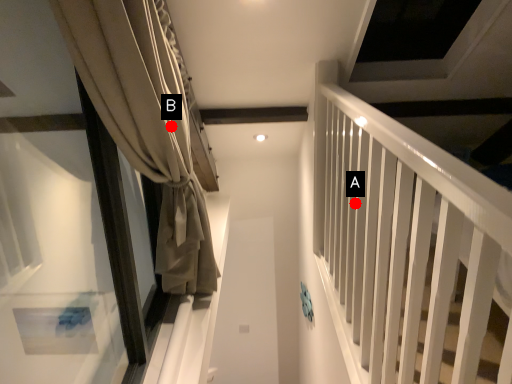
Question: Two points are circled on the image, labeled by A and B beside each circle. Which of the following is the farthest from the observer?

Choices:
 (A) A is further
 (B) B is further

Answer: (A)